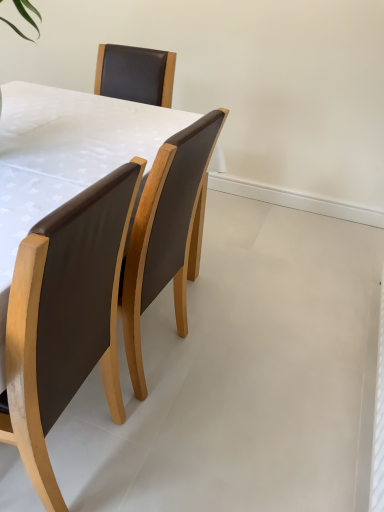
Question: Considering the positions of brown leather table at center and brown leather chair at left in the image, is brown leather table at center wider or thinner than brown leather chair at left?

Choices:
 (A) wide
 (B) thin

Answer: (A)

Question: Is brown leather table at center inside the boundaries of brown leather chair at left, or outside?

Choices:
 (A) outside
 (B) inside

Answer: (A)

Question: Looking at the image, does brown leather table at center seem bigger or smaller compared to brown leather chair at left?

Choices:
 (A) small
 (B) big

Answer: (B)

Question: Considering their positions, is brown leather chair at left located in front of or behind brown leather table at center?

Choices:
 (A) front
 (B) behind

Answer: (A)

Question: Would you say brown leather chair at left is inside or outside brown leather table at center?

Choices:
 (A) outside
 (B) inside

Answer: (A)

Question: Looking at their shapes, would you say brown leather chair at left is wider or thinner than brown leather table at center?

Choices:
 (A) wide
 (B) thin

Answer: (B)

Question: From a real-world perspective, is brown leather chair at left physically located above or below brown leather table at center?

Choices:
 (A) above
 (B) below

Answer: (A)